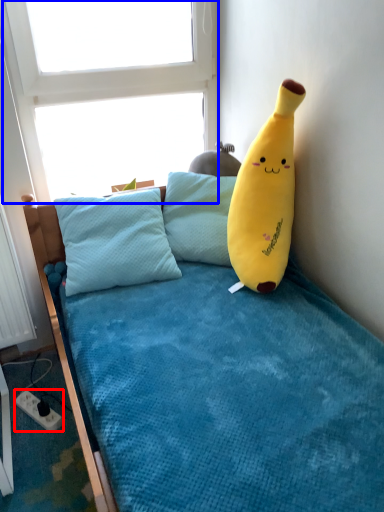
Question: Which of the following is the farthest to the observer, power outlet (highlighted by a red box) or window screen (highlighted by a blue box)?

Choices:
 (A) power outlet
 (B) window screen

Answer: (A)